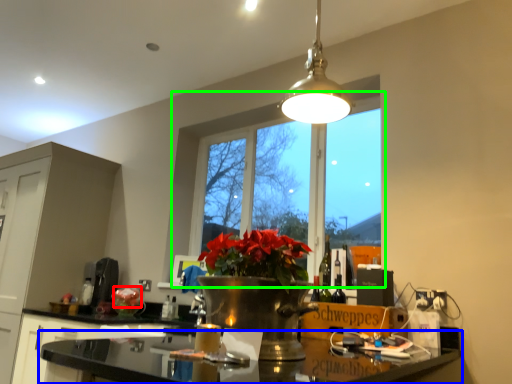
Question: Which object is the closest to the flower (highlighted by a red box)? Choose among these: countertop (highlighted by a blue box) or window (highlighted by a green box).

Choices:
 (A) countertop
 (B) window

Answer: (A)